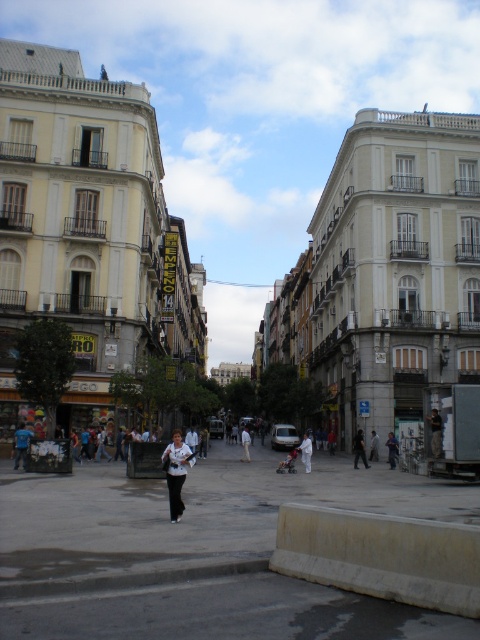
Question: Is dark gray fabric jacket at lower right smaller than white cotton pants at center?

Choices:
 (A) no
 (B) yes

Answer: (B)

Question: Can you confirm if white matte stroller at center is bigger than light gray fabric jacket at center?

Choices:
 (A) yes
 (B) no

Answer: (A)

Question: Which object is farther from the camera taking this photo?

Choices:
 (A) blue fabric shirt at lower left
 (B) white cotton shirt at center
 (C) dark blue jeans at center
 (D) light gray fabric jacket at center

Answer: (D)

Question: Which point is closer to the camera?

Choices:
 (A) dark blue jeans at center
 (B) black fabric person at center
 (C) blue fabric shirt at lower left
 (D) white cotton pants at center

Answer: (C)

Question: Which object is positioned closest to the dark blue jeans at center?

Choices:
 (A) white matte stroller at center
 (B) black fabric person at center

Answer: (B)

Question: Observing the image, what is the correct spatial positioning of blue fabric shirt at lower left in reference to white cotton pants at center?

Choices:
 (A) right
 (B) left

Answer: (B)